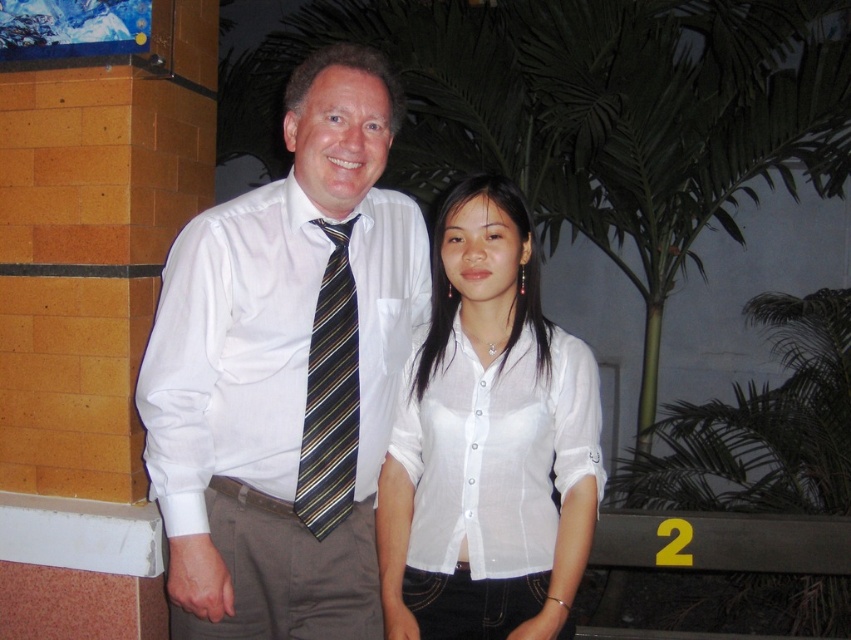
Question: Considering the real-world distances, which object is farthest from the white shirt at center?

Choices:
 (A) white sheer blouse at center
 (B) striped fabric tie at center

Answer: (A)

Question: Is white shirt at center smaller than white sheer blouse at center?

Choices:
 (A) no
 (B) yes

Answer: (A)

Question: Which object is positioned closest to the white sheer blouse at center?

Choices:
 (A) white shirt at center
 (B) striped fabric tie at center

Answer: (A)

Question: Which point is farther to the camera?

Choices:
 (A) striped fabric tie at center
 (B) white sheer blouse at center
 (C) white shirt at center

Answer: (A)

Question: Is white shirt at center to the right of white sheer blouse at center from the viewer's perspective?

Choices:
 (A) yes
 (B) no

Answer: (B)

Question: Can you confirm if white sheer blouse at center is positioned to the right of striped fabric tie at center?

Choices:
 (A) no
 (B) yes

Answer: (B)